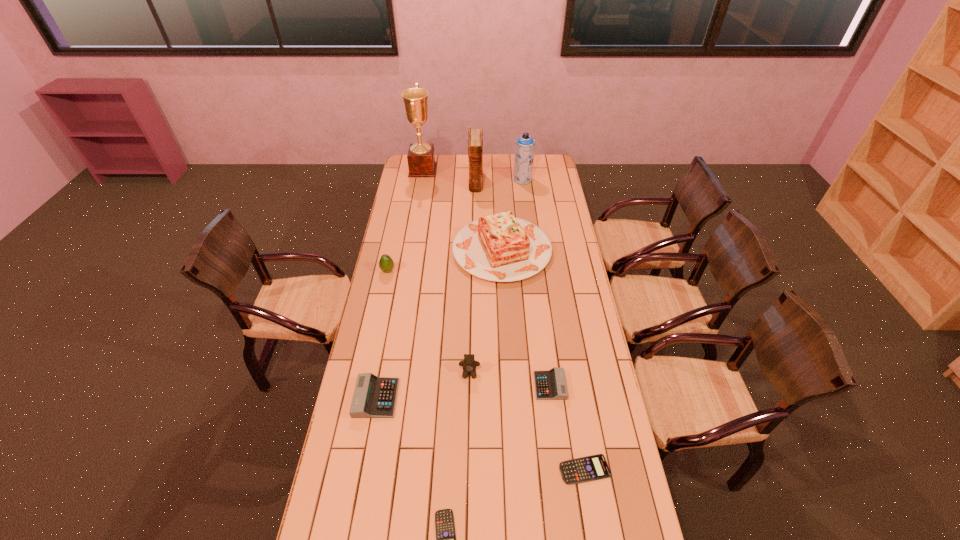
The height and width of the screenshot is (540, 960). I want to click on the second tallest calculator, so click(549, 385).

Find the location of `the second shortest calculator`. the second shortest calculator is located at coordinates (589, 468).

Find the location of a particular element. the right blue calculator is located at coordinates (589, 468).

Identify the location of vacant space situated on the plaque of the trophy cup. The image size is (960, 540). (466, 170).

I want to click on free spot located 0.350m on the spine side of the hardback book, so click(x=475, y=232).

I want to click on vacant region located 0.120m on the front of the blue aerosol can, so click(x=525, y=197).

The image size is (960, 540). Identify the location of vacant space positioned on the back of the orange lasagna. (498, 185).

Locate an element on the screen. The height and width of the screenshot is (540, 960). vacant space located on the right of the green avocado is located at coordinates (481, 271).

Identify the location of vacant space positioned 0.300m on the face of the brown teddy bear. This screenshot has height=540, width=960. (468, 461).

Where is `free space located 0.170m on the back of the leftmost calculator`? The height and width of the screenshot is (540, 960). free space located 0.170m on the back of the leftmost calculator is located at coordinates (387, 342).